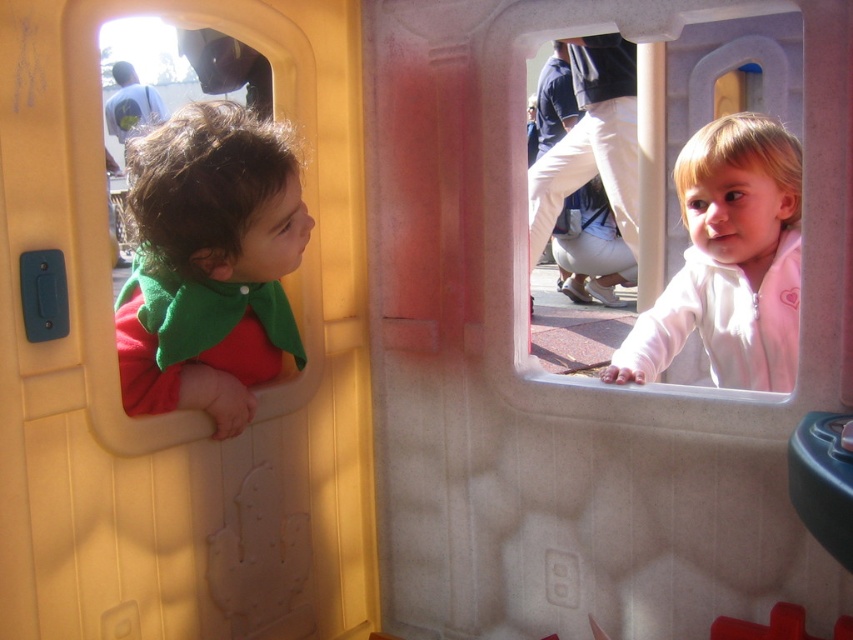
Question: Which object is positioned closest to the white fleece jacket at upper right?

Choices:
 (A) white cotton pants at center
 (B) matte green cape at left

Answer: (B)

Question: Does white fleece jacket at upper right have a smaller size compared to white cotton pants at center?

Choices:
 (A) yes
 (B) no

Answer: (A)

Question: Which object is farther from the camera taking this photo?

Choices:
 (A) matte green cape at left
 (B) white fleece jacket at upper right
 (C) white cotton pants at center

Answer: (C)

Question: Is matte green cape at left wider than white fleece jacket at upper right?

Choices:
 (A) no
 (B) yes

Answer: (A)

Question: Can you confirm if matte green cape at left is positioned to the right of white fleece jacket at upper right?

Choices:
 (A) no
 (B) yes

Answer: (A)

Question: Which object is closer to the camera taking this photo?

Choices:
 (A) matte green cape at left
 (B) white fleece jacket at upper right
 (C) white cotton pants at center

Answer: (A)